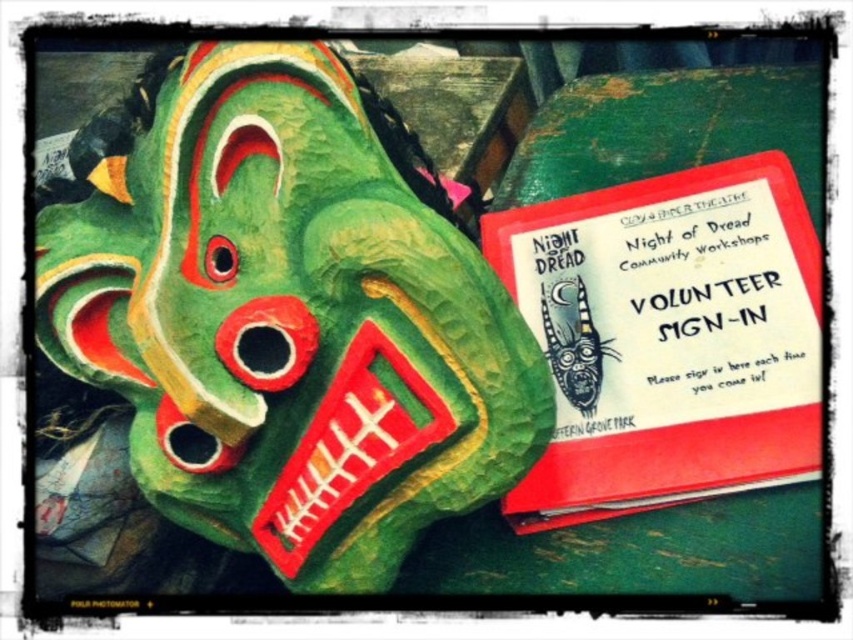
You are standing in front of the vibrant green mask with red accents and white highlights. There is a red sign to the right of it that says Night of Dread Community Workshops. You want to touch the point at coordinates point (590, 433). Is this point closer to you than the mask?

The distance of point (590, 433) from camera is 37.26 inches, so the point is 37.26 inches away from you. Since the mask is closer than that point, the point is farther away than the mask.

You are standing in front of the green mask with red accents and white highlights. There are two points marked on the mask. One is at coordinates point (694, 388) and the other at point (569, 312). Which point is closer to you?

Point (694, 388) is closer to the viewer than point (569, 312).